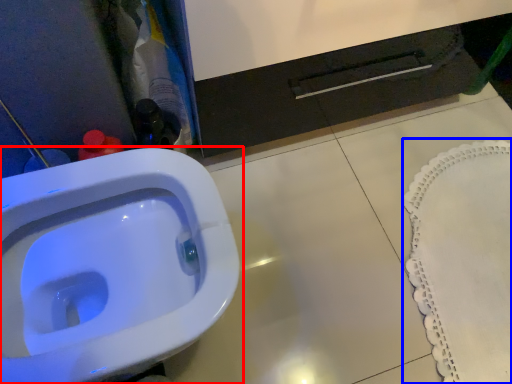
Question: Which of the following is the closest to the observer, toilet (highlighted by a red box) or bath mat (highlighted by a blue box)?

Choices:
 (A) toilet
 (B) bath mat

Answer: (A)